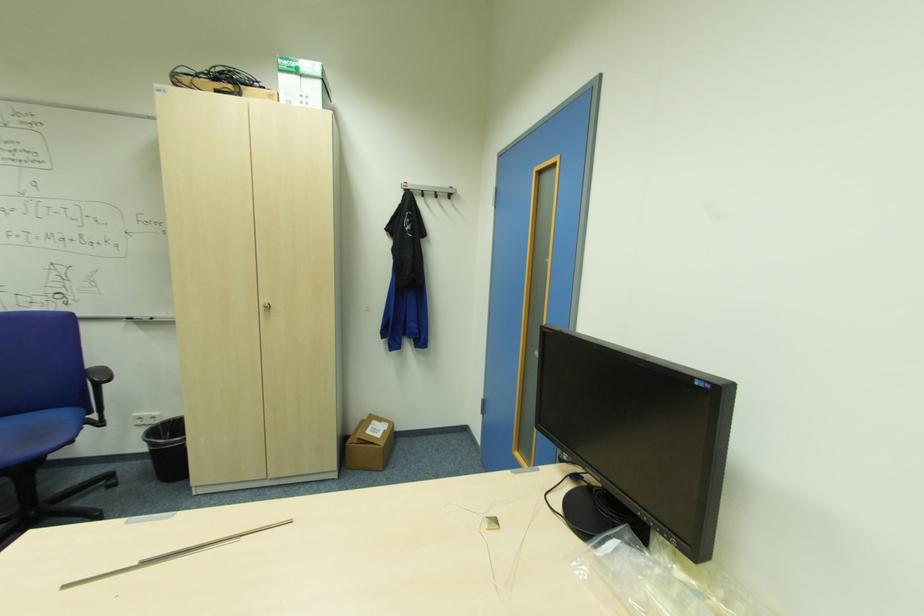
This screenshot has width=924, height=616. Describe the element at coordinates (33, 436) in the screenshot. I see `the blue chair sitting surface` at that location.